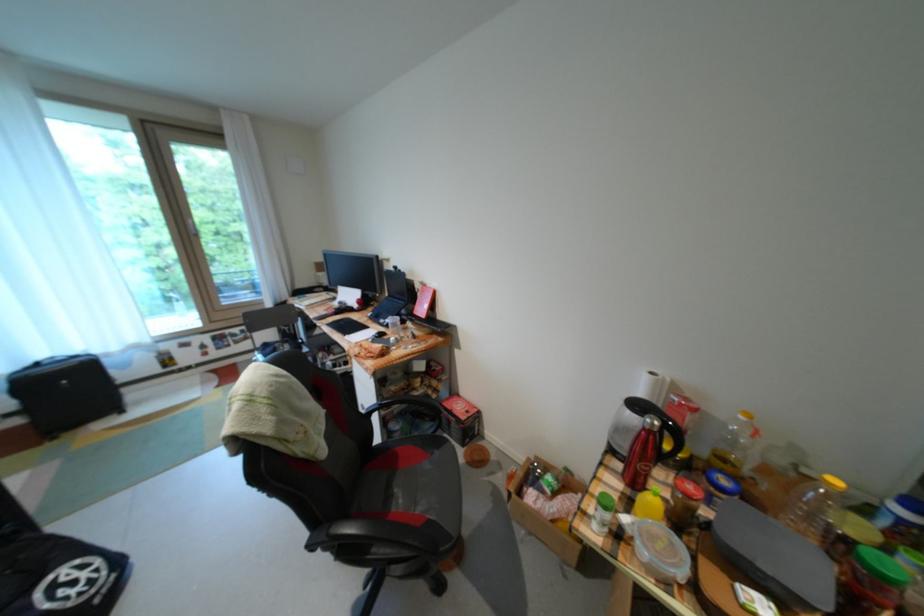
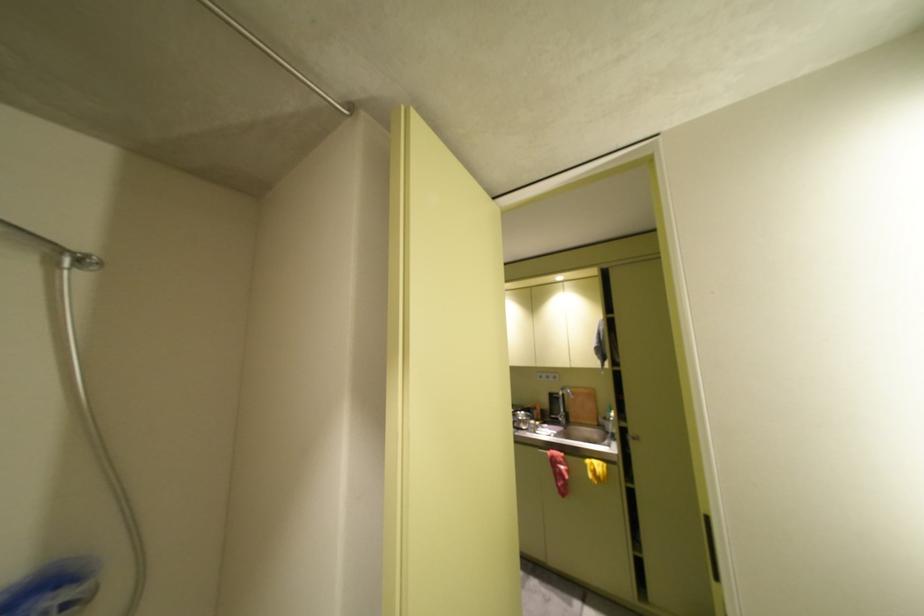
Question: Which direction would the cameraman need to move to produce the second image? Reply with the corresponding letter.

Choices:
 (A) Left
 (B) Right
 (C) Forward
 (D) Backward

Answer: (D)